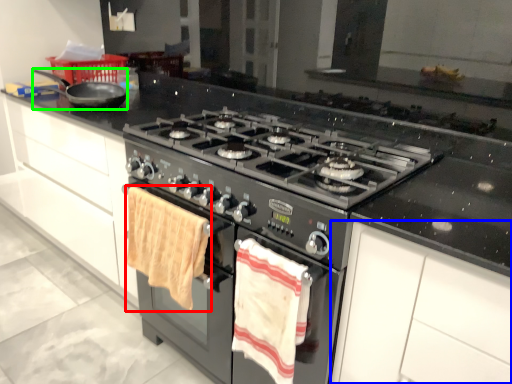
Question: Which object is positioned closest to beach towel (highlighted by a red box)? Select from cabinetry (highlighted by a blue box) and frying pan (highlighted by a green box).

Choices:
 (A) cabinetry
 (B) frying pan

Answer: (A)